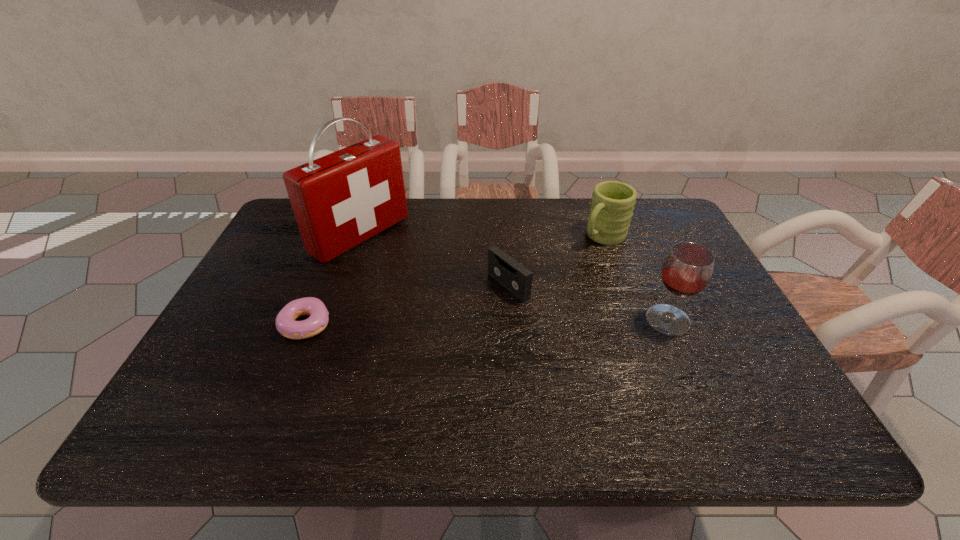
Identify the location of doughnut. (285, 322).

Where is `the fourth shortest object`? The width and height of the screenshot is (960, 540). the fourth shortest object is located at coordinates (686, 271).

The width and height of the screenshot is (960, 540). What are the coordinates of `mug` in the screenshot? It's located at (612, 204).

The width and height of the screenshot is (960, 540). I want to click on the first-aid kit, so click(340, 200).

This screenshot has height=540, width=960. I want to click on the third farthest object, so click(501, 267).

Locate an element on the screen. Image resolution: width=960 pixels, height=540 pixels. the third object from left to right is located at coordinates (501, 267).

Locate an element on the screen. vacant space located 0.080m on the front of the doughnut is located at coordinates (286, 373).

Identify the location of vacant region located 0.120m on the left of the wineglass. (596, 320).

Locate an element on the screen. The image size is (960, 540). free spot located 0.300m on the side of the third shortest object with the handle is located at coordinates (524, 299).

Identify the location of vacant area situated 0.280m on the side of the third shortest object with the handle. (529, 295).